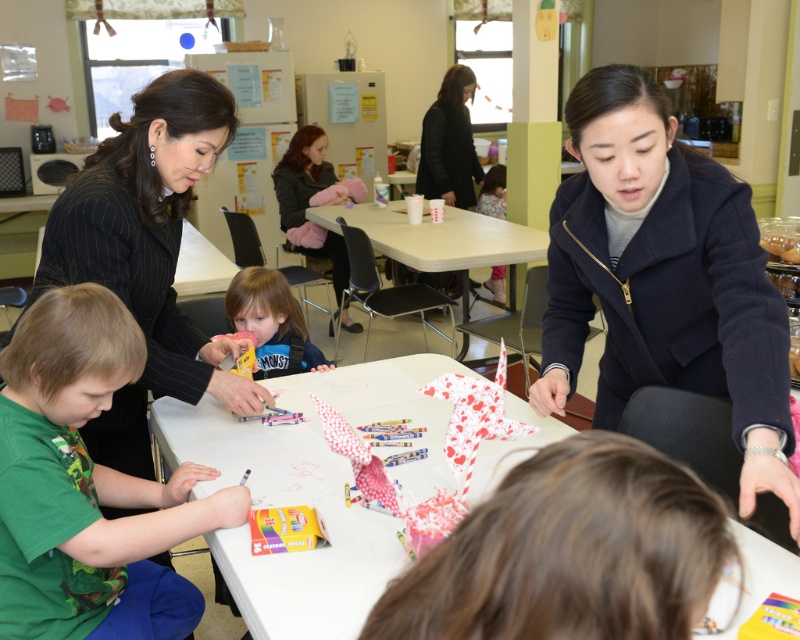
Can you confirm if matte yellow crayon at center is positioned above black fabric woman at upper center?

Incorrect, matte yellow crayon at center is not positioned above black fabric woman at upper center.

Who is positioned more to the left, matte yellow crayon at center or black fabric woman at upper center?

matte yellow crayon at center is more to the left.

Is point (276, 346) behind point (462, 141)?

That is False.

In order to click on matte yellow crayon at center in this screenshot , I will do `click(272, 323)`.

Consider the image. Does black pinstripe suit at upper left have a smaller size compared to black fabric woman at upper center?

Actually, black pinstripe suit at upper left might be larger than black fabric woman at upper center.

How far apart are black pinstripe suit at upper left and black fabric woman at upper center?

black pinstripe suit at upper left and black fabric woman at upper center are 11.99 feet apart from each other.

Describe the element at coordinates (148, 253) in the screenshot. The image size is (800, 640). I see `black pinstripe suit at upper left` at that location.

Where is `black pinstripe suit at upper left`? Image resolution: width=800 pixels, height=640 pixels. black pinstripe suit at upper left is located at coordinates (148, 253).

Is green fabric shirt at lower left taller than white paper origami at center?

Yes, green fabric shirt at lower left is taller than white paper origami at center.

The height and width of the screenshot is (640, 800). What are the coordinates of `green fabric shirt at lower left` in the screenshot? It's located at (88, 484).

Which is behind, point (73, 360) or point (480, 211)?

Point (480, 211)

This screenshot has width=800, height=640. In order to click on green fabric shirt at lower left in this screenshot , I will do `click(88, 484)`.